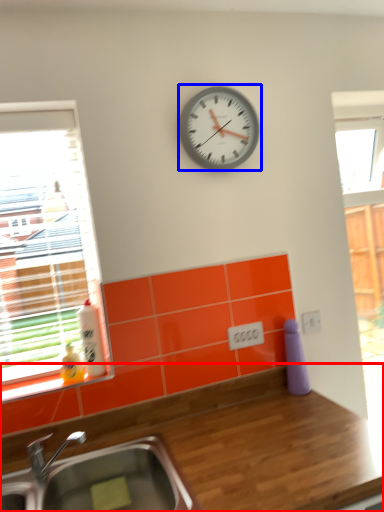
Question: Which object appears closest to the camera in this image, countertop (highlighted by a red box) or wall clock (highlighted by a blue box)?

Choices:
 (A) countertop
 (B) wall clock

Answer: (A)